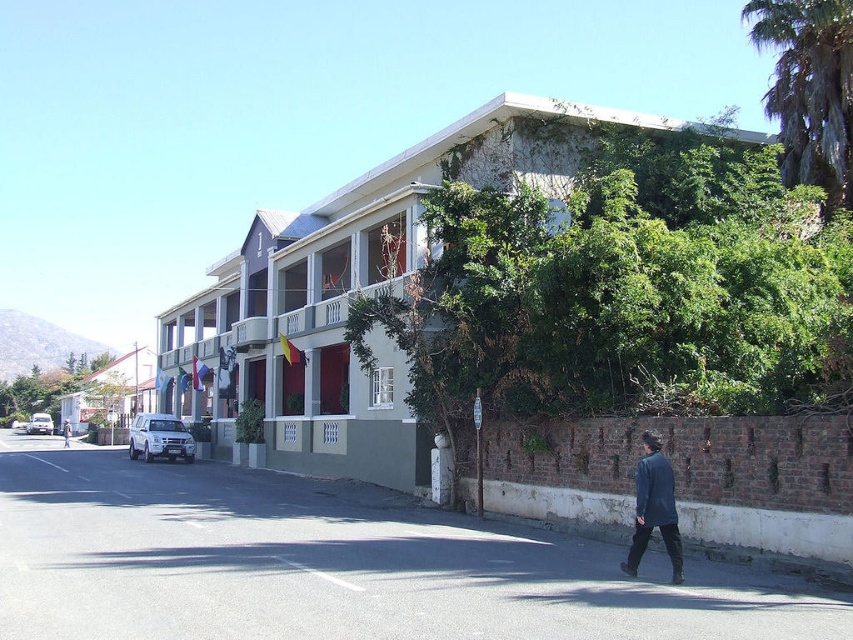
Based on the photo, you are a delivery person trying to carry a large package that requires both hands. You see the dark blue fabric coat at lower right and the light blue denim jacket at lower right. Which clothing item would you choose to hold the package with one hand while walking?

The dark blue fabric coat at lower right has a lesser width compared to the light blue denim jacket at lower right, so the dark blue fabric coat at lower right is narrower and easier to hold with one hand while carrying the package.